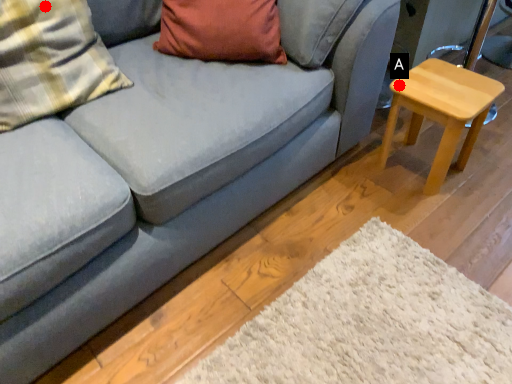
Question: Two points are circled on the image, labeled by A and B beside each circle. Which point appears farthest from the camera in this image?

Choices:
 (A) A is further
 (B) B is further

Answer: (A)